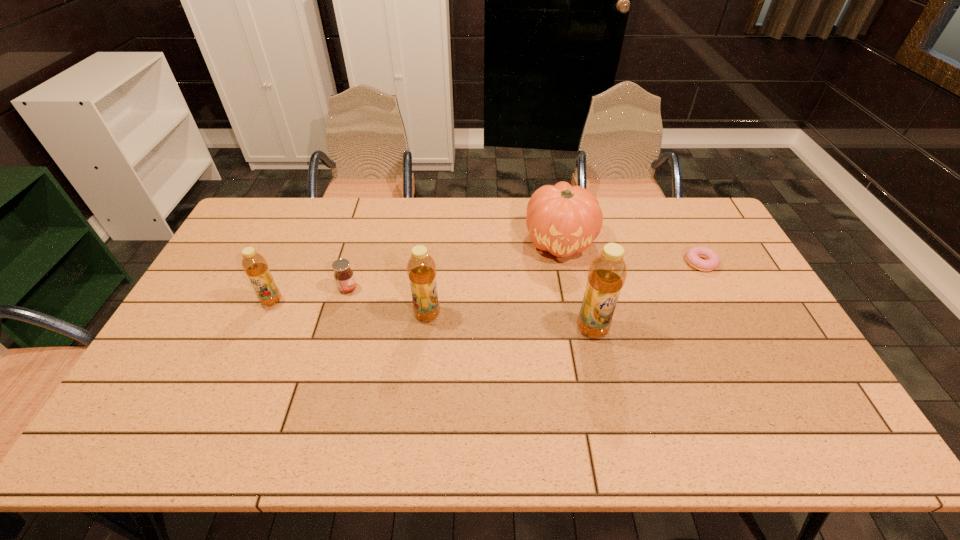
Identify the location of the second shortest object. [343, 274].

Locate an element on the screen. vacant space located on the back of the leftmost object is located at coordinates (292, 255).

Locate an element on the screen. Image resolution: width=960 pixels, height=540 pixels. vacant area situated 0.260m on the right of the second bottle from left to right is located at coordinates click(530, 314).

Image resolution: width=960 pixels, height=540 pixels. What are the coordinates of `free space located on the front of the tallest object` in the screenshot? It's located at (609, 401).

This screenshot has width=960, height=540. What are the coordinates of `free space located on the carved face of the pumpkin` in the screenshot? It's located at (568, 285).

Locate an element on the screen. vacant space located on the front of the shortest object is located at coordinates (755, 367).

Image resolution: width=960 pixels, height=540 pixels. In order to click on vacant area situated 0.400m on the label side of the second shortest object in this screenshot , I will do `click(487, 288)`.

I want to click on object positioned at the far edge, so click(x=562, y=219).

Identify the location of object at the right edge. (693, 255).

Identify the location of vacant area at the far edge. (620, 200).